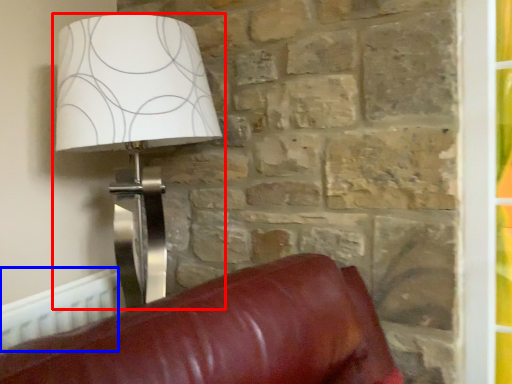
Question: Which point is closer to the camera, lamp (highlighted by a red box) or radiator (highlighted by a blue box)?

Choices:
 (A) lamp
 (B) radiator

Answer: (A)